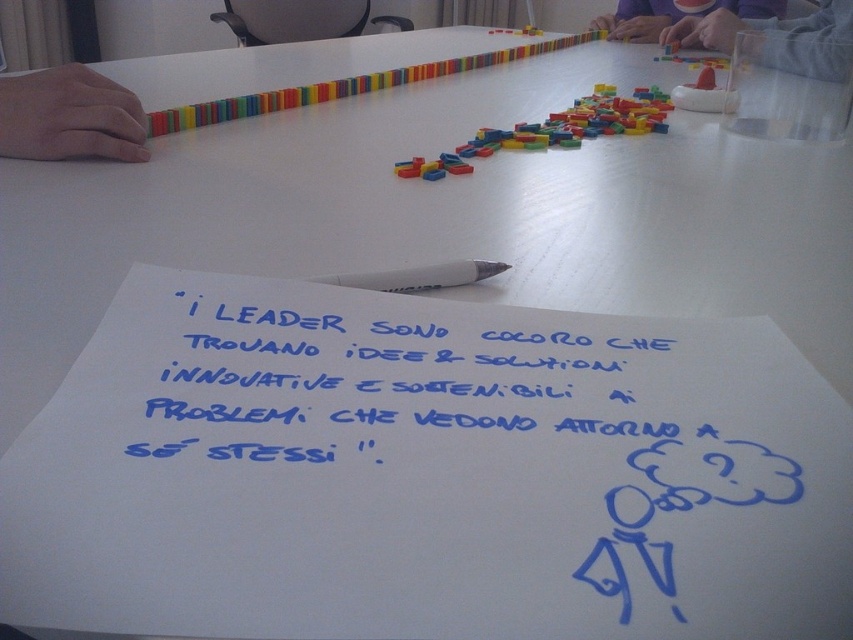
Based on the scene description, what is the significance of the point at coordinates (381, 378)?

The point at coordinates (381, 378) corresponds to the blue ink writing at the center of the paper, indicating the location of the text that emphasizes leadership through innovative and sustainable solutions.

You are a participant in the collaborative activity. You need to reach for the matte plastic cup at upper right to get a drink, but there is a matte skin hand at left in the way. Can you move your hand around the hand to the left to access the cup?

The matte skin hand at left is to the left of the matte plastic cup at upper right, so you can move your hand around the hand to the left to access the cup by moving to the right side of the hand.